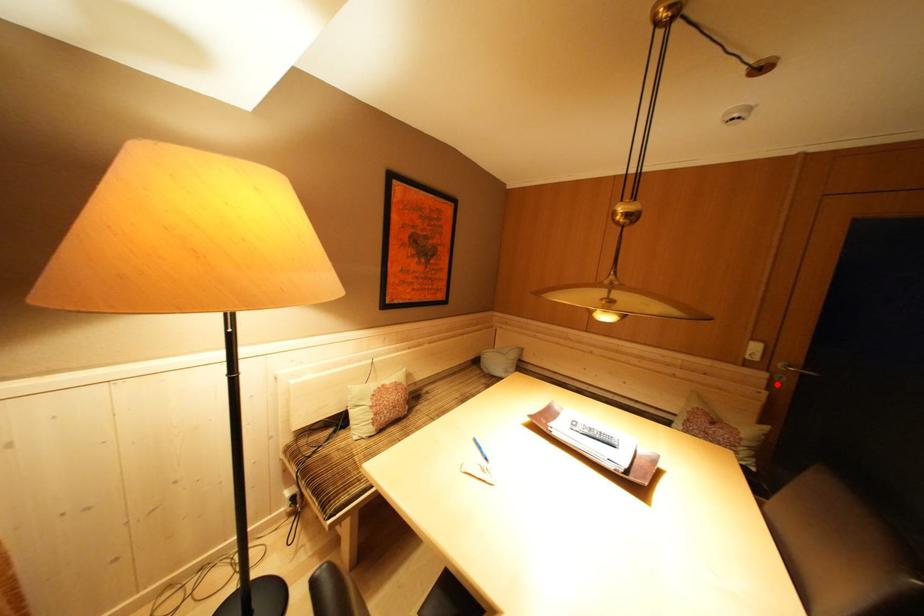
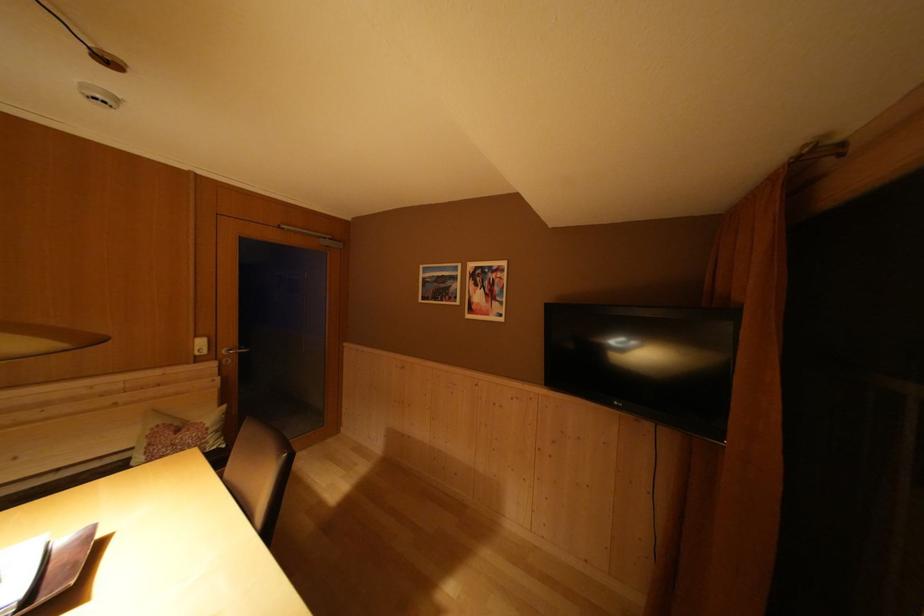
The point at the highlighted location is marked in the first image. Where is the corresponding point in the second image?

(226, 371)